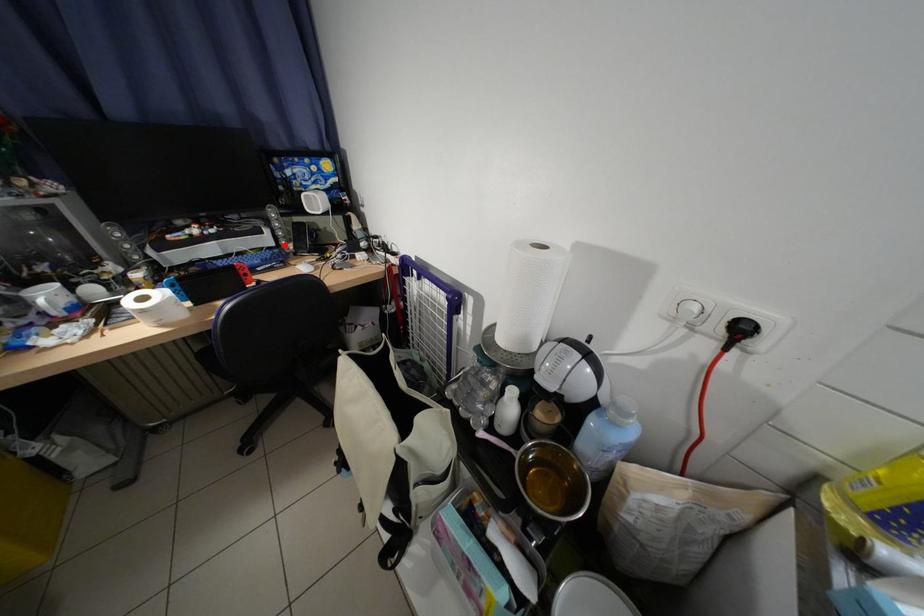
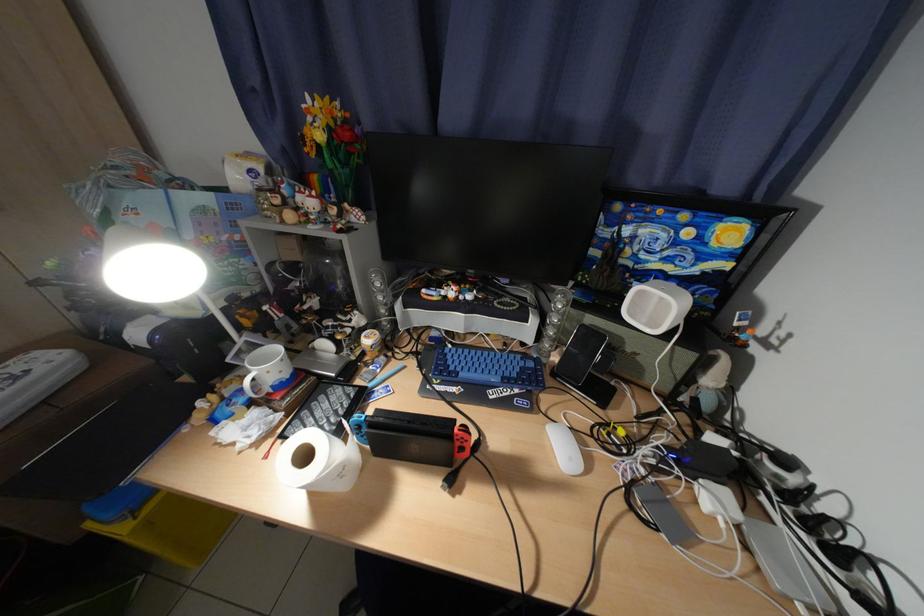
The point at the highlighted location is marked in the first image. Where is the corresponding point in the second image?

(541, 342)